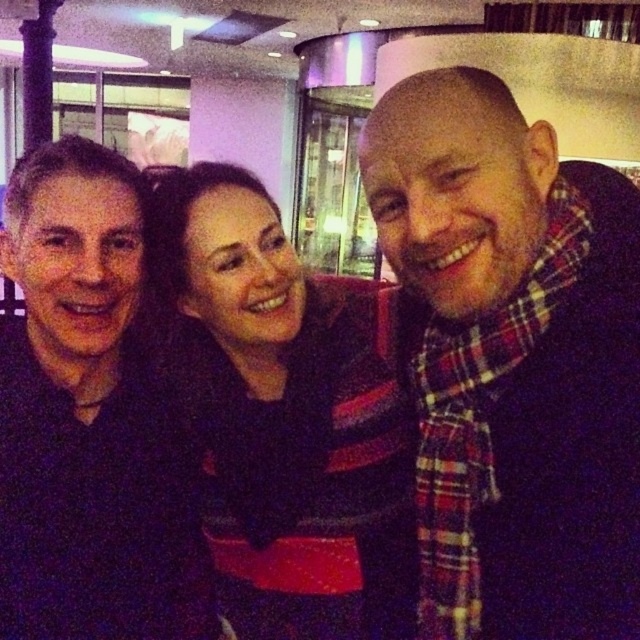
Is plaid scarf at right thinner than black knitwear at center?

Indeed, plaid scarf at right has a lesser width compared to black knitwear at center.

Which is in front, point (570, 604) or point (282, 413)?

Point (570, 604) is more forward.

Locate an element on the screen. The image size is (640, 640). plaid scarf at right is located at coordinates (512, 362).

How much distance is there between plaid scarf at right and dark blue shirt at left?

plaid scarf at right is 18.37 inches away from dark blue shirt at left.

Is plaid scarf at right closer to camera compared to dark blue shirt at left?

Yes, it is in front of dark blue shirt at left.

Does point (604, 289) lie in front of point (32, 432)?

Yes, point (604, 289) is closer to viewer.

Locate an element on the screen. plaid scarf at right is located at coordinates (512, 362).

You are a GUI agent. You are given a task and a screenshot of the screen. Output one action in this format:
    pyautogui.click(x=<x>, y=<y>)
    Task: Click on the black knitwear at center
    
    Given the screenshot: What is the action you would take?
    pyautogui.click(x=282, y=419)